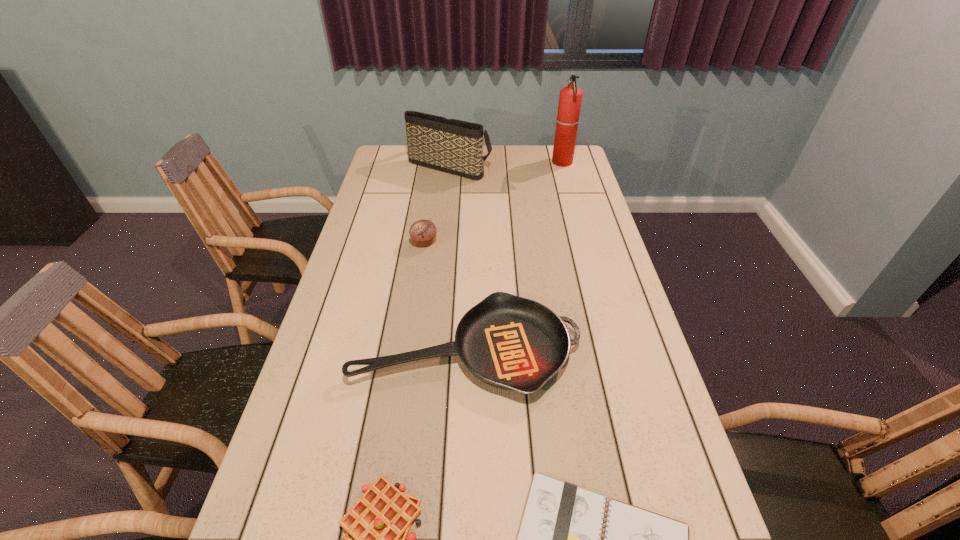
Find the location of `fire extinguisher`. fire extinguisher is located at coordinates (570, 98).

Find the location of a particular element. The width and height of the screenshot is (960, 540). handbag is located at coordinates (454, 146).

The width and height of the screenshot is (960, 540). I want to click on the third farthest object, so click(422, 232).

This screenshot has width=960, height=540. I want to click on the third tallest object, so click(x=422, y=232).

Where is `the third nearest object`? the third nearest object is located at coordinates (509, 342).

Locate an element on the screen. The image size is (960, 540). the third shortest object is located at coordinates [x=509, y=342].

You are a GUI agent. You are given a task and a screenshot of the screen. Output one action in this format:
    pyautogui.click(x=<x>, y=<y>)
    Task: Click on the vacant space located 0.060m with the nozzle and gauge on the tallest object
    
    Given the screenshot: What is the action you would take?
    pyautogui.click(x=538, y=163)

The height and width of the screenshot is (540, 960). I want to click on vacant space located with the nozzle and gauge on the tallest object, so click(x=488, y=163).

The width and height of the screenshot is (960, 540). Identify the location of free space located 0.170m with the nozzle and gauge on the tallest object. pyautogui.click(x=512, y=163).

At what (x,y) coordinates should I click in order to perform the action: click on free spot located on the left of the handbag. Please return your answer as a coordinate pair (x, y). Looking at the image, I should click on click(377, 165).